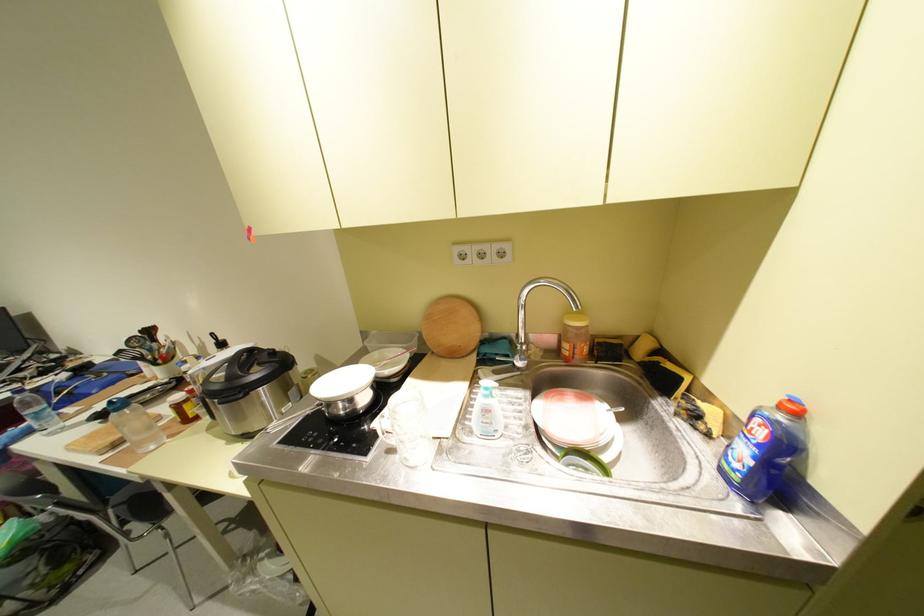
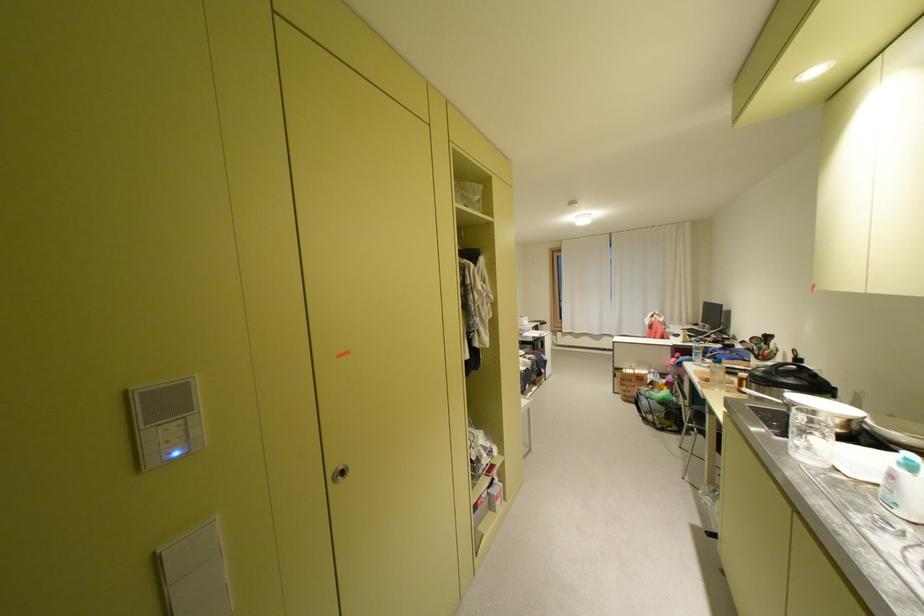
Where in the second image is the point corresponding to point (507, 431) from the first image?

(906, 505)